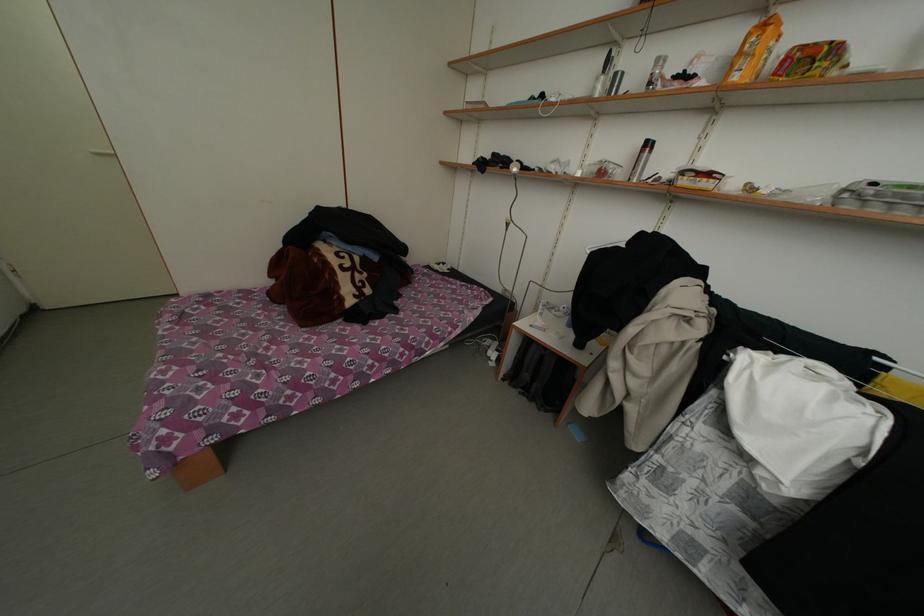
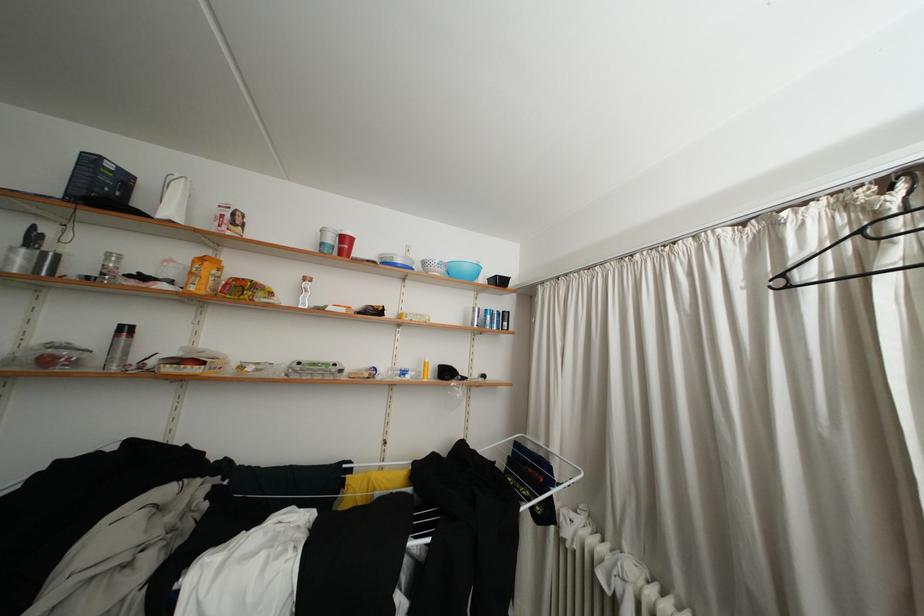
The point at (744, 83) is marked in the first image. Where is the corresponding point in the second image?

(200, 294)